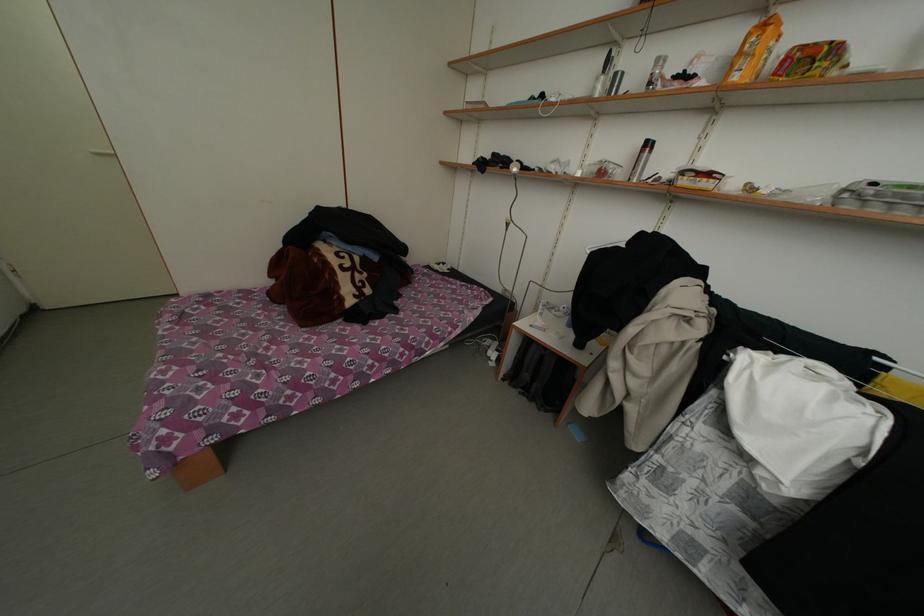
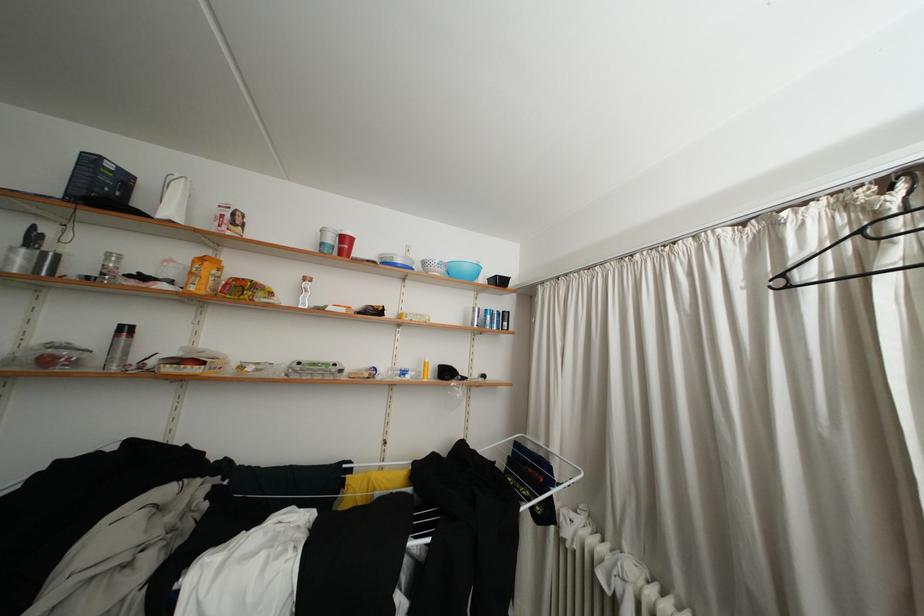
The point at (744, 83) is marked in the first image. Where is the corresponding point in the second image?

(200, 294)